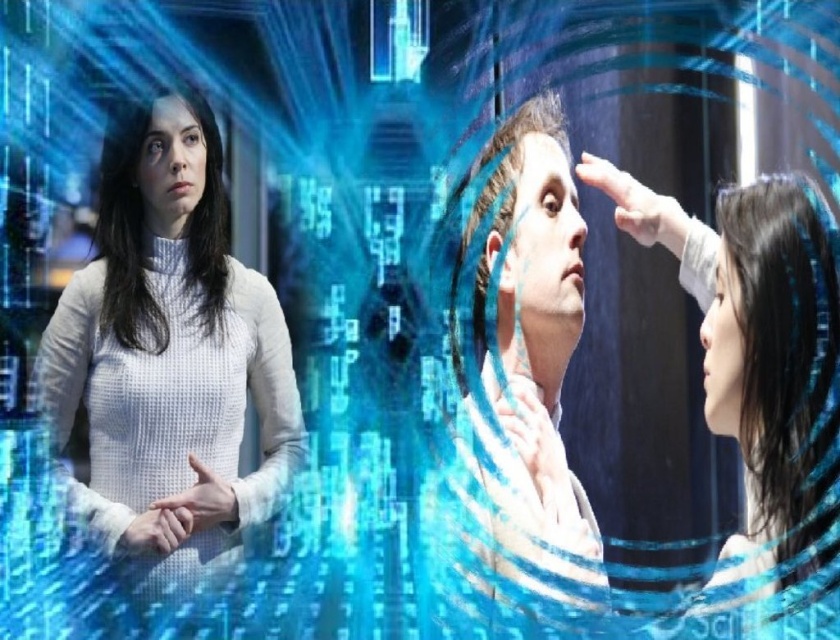
Image resolution: width=840 pixels, height=640 pixels. What do you see at coordinates (786, 365) in the screenshot?
I see `black silky hair at right` at bounding box center [786, 365].

Can you confirm if black silky hair at right is thinner than white matte hand at center?

No.

Where is `black silky hair at right`? The image size is (840, 640). black silky hair at right is located at coordinates (786, 365).

Can you confirm if black matte hair at left is positioned to the right of blonde hair at center?

In fact, black matte hair at left is to the left of blonde hair at center.

Looking at this image, who is higher up, black matte hair at left or blonde hair at center?

black matte hair at left is above.

Locate an element on the screen. Image resolution: width=840 pixels, height=640 pixels. black matte hair at left is located at coordinates (145, 228).

Where is `black matte hair at left`? The image size is (840, 640). black matte hair at left is located at coordinates (145, 228).

Who is more distant from viewer, (798, 387) or (827, 298)?

Point (827, 298)

The image size is (840, 640). Describe the element at coordinates (762, 376) in the screenshot. I see `smooth black hair at right` at that location.

The width and height of the screenshot is (840, 640). Find the location of `smooth black hair at right`. smooth black hair at right is located at coordinates (762, 376).